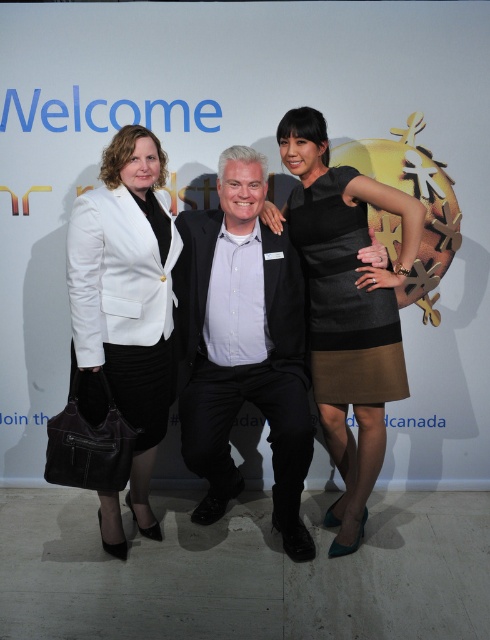
Question: Which object is farther from the camera taking this photo?

Choices:
 (A) black satin dress at center
 (B) black cotton suit at center
 (C) matte black blazer at left

Answer: (B)

Question: Is black cotton suit at center positioned before black satin dress at center?

Choices:
 (A) yes
 (B) no

Answer: (B)

Question: Which object appears closest to the camera in this image?

Choices:
 (A) matte black blazer at left
 (B) black cotton suit at center
 (C) black satin dress at center

Answer: (A)

Question: Which object appears farthest from the camera in this image?

Choices:
 (A) black cotton suit at center
 (B) black satin dress at center
 (C) matte black blazer at left

Answer: (A)

Question: Does black satin dress at center appear on the right side of matte black blazer at left?

Choices:
 (A) no
 (B) yes

Answer: (B)

Question: Is black satin dress at center above matte black blazer at left?

Choices:
 (A) yes
 (B) no

Answer: (A)